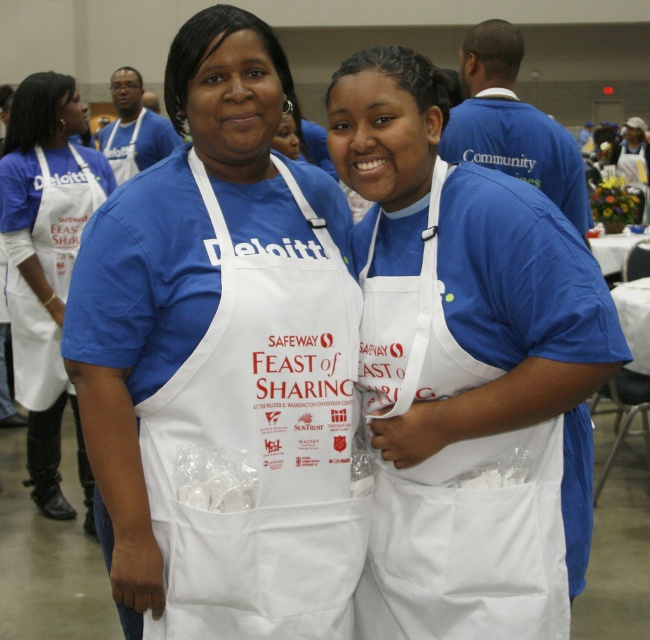
You are organizing a community event and need to place a decorative banner. The banner requires a spot directly in front of the white fabric apron at center. Based on the coordinates provided, where should you position the banner?

The white fabric apron at center is located at point (469, 541), so you should position the banner directly in front of this coordinate to ensure it is centered appropriately.

You are organizing a community event and need to determine which apron to use for the volunteers. The volunteers need aprons that are wider to cover their clothing better. Based on the image, which apron should you choose between the white matte apron at center and the white paper apron at center?

The white matte apron at center is wider than the white paper apron at center, so you should choose the white matte apron at center for better coverage.